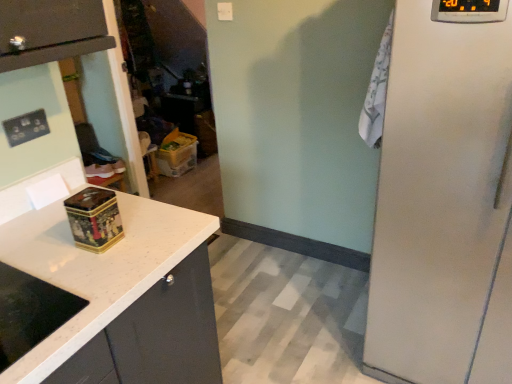
At what (x,y) coordinates should I click in order to perform the action: click on empty space that is ontop of white granite countertop at left (from a real-world perspective). Please return your answer as a coordinate pair (x, y). This screenshot has width=512, height=384. Looking at the image, I should click on (71, 259).